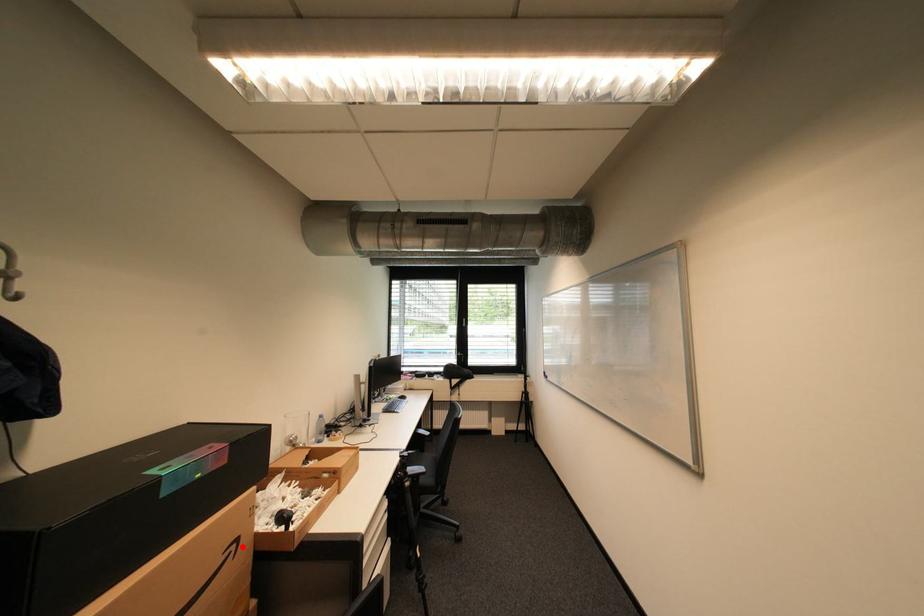
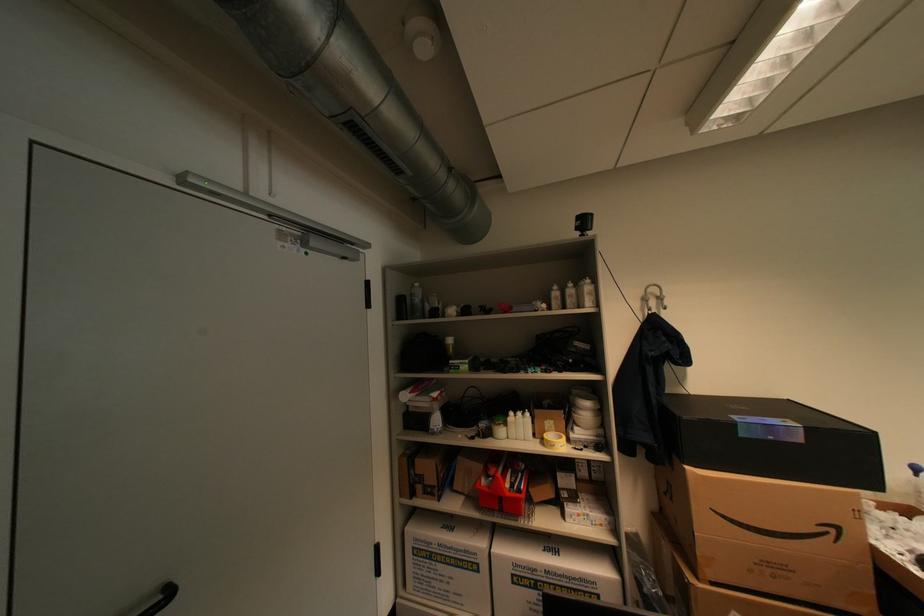
Question: A red point is marked in image1. In image2, is the corresponding 3D point closer to the camera or farther? Reply with the corresponding letter.

Choices:
 (A) The corresponding 3D point is closer.
 (B) The corresponding 3D point is farther.

Answer: (A)